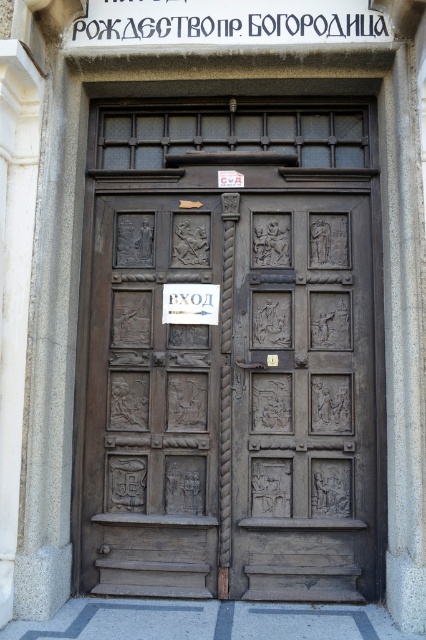
You are a photographer standing in front of the brown carved wood door at center. You want to take a photo of the door without any distortion. What is the minimum distance you should stand from the door to capture it in full frame?

The minimum distance you should stand from the brown carved wood door at center is 4.44 meters to avoid distortion and capture it in full frame.

You are an architect examining the door structure. You need to determine which door, the dark wood door at center or the brown carved wood door at center, requires more material for a replica. Which one would you choose?

The dark wood door at center is bigger than the brown carved wood door at center, so the dark wood door at center would require more material for a replica.